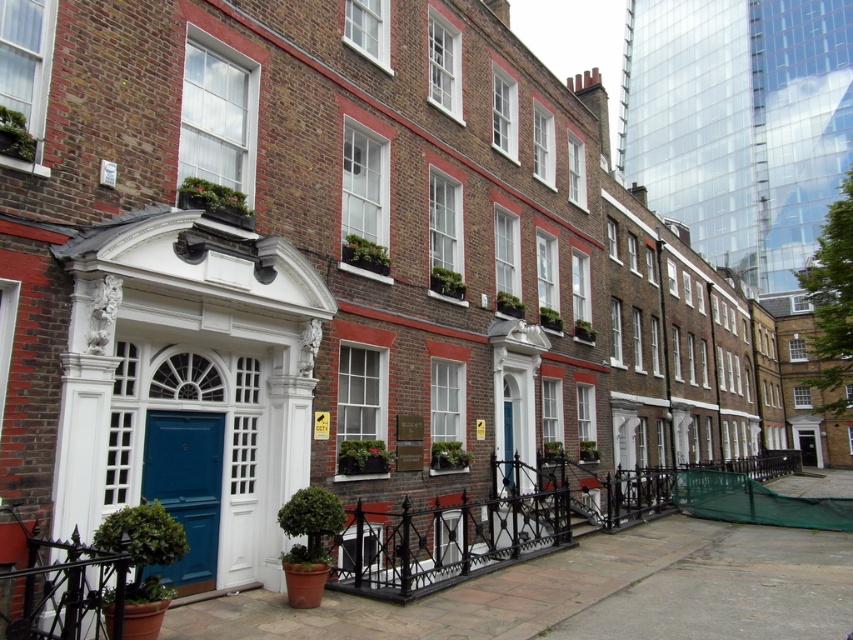
You are a painter hired to paint both the black wrought iron fence at center and the blue glossy door at center. Which object will require more ladder use due to its height?

The black wrought iron fence at center is much taller than the blue glossy door at center, so it will require more ladder use due to its height.

You are a delivery person trying to reach the blue glossy door at center. There is a black wrought iron fence at center in your way. Can you step over the fence to reach the door?

The black wrought iron fence at center is below the blue glossy door at center, so the fence is positioned lower than the door. Since the fence is at a lower level, you can step over it to reach the blue glossy door at center.

You are a delivery person trying to pass through the area between the black wrought iron fence at center and the blue glossy door at center. Can you fit through the space if your delivery cart is 1.5 meters wide?

The black wrought iron fence at center might be wider than blue glossy door at center, so the space between them could be wider than the cart. However, the exact width isn not specified. You should check the actual distance before proceeding.